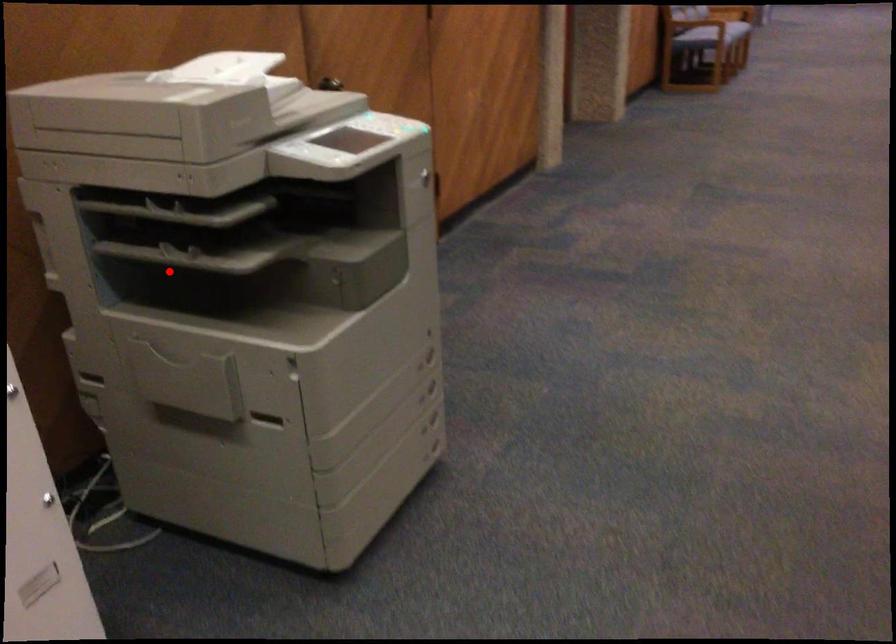
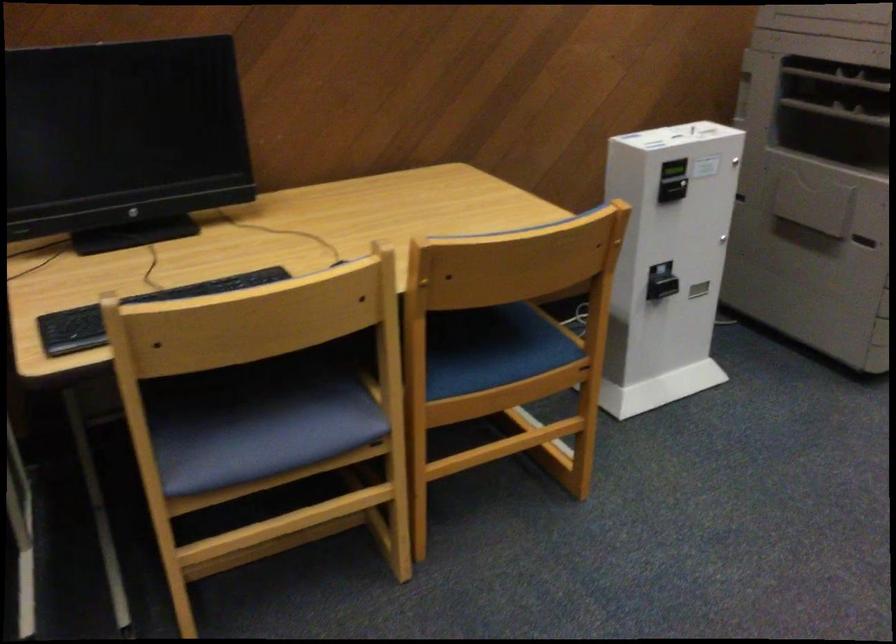
Find the pixel in the second image that matches the highlighted location in the first image.

(836, 111)